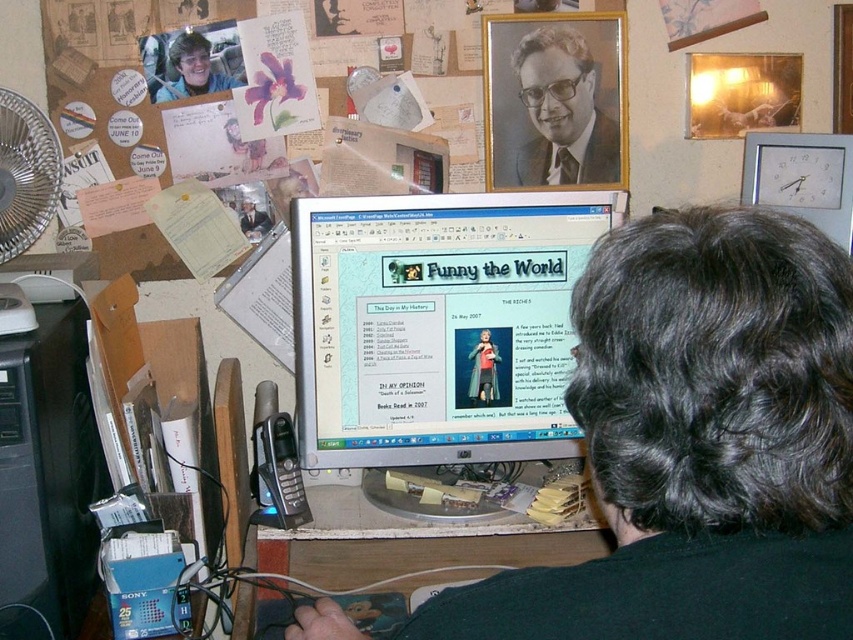
Between silver metallic computer monitor at center and formal black suit at upper center, which one appears on the right side from the viewer's perspective?

formal black suit at upper center is more to the right.

Can you confirm if silver metallic computer monitor at center is shorter than formal black suit at upper center?

Incorrect, silver metallic computer monitor at center's height does not fall short of formal black suit at upper center's.

Is point (387, 362) positioned before point (595, 173)?

Yes.

This screenshot has width=853, height=640. I want to click on silver metallic computer monitor at center, so click(x=437, y=323).

Between silver metallic computer monitor at center and matte black laptop at center, which one appears on the right side from the viewer's perspective?

silver metallic computer monitor at center

Is silver metallic computer monitor at center taller than matte black laptop at center?

Yes.

Does point (509, 193) come in front of point (270, 221)?

Yes, it is.

You are a GUI agent. You are given a task and a screenshot of the screen. Output one action in this format:
    pyautogui.click(x=<x>, y=<y>)
    Task: Click on the silver metallic computer monitor at center
    
    Given the screenshot: What is the action you would take?
    pyautogui.click(x=437, y=323)

Does wooden at center have a greater height compared to white plastic clock at upper right?

No.

Does wooden at center appear on the left side of white plastic clock at upper right?

Indeed, wooden at center is positioned on the left side of white plastic clock at upper right.

Is point (407, 538) less distant than point (817, 200)?

Yes, point (407, 538) is in front of point (817, 200).

The height and width of the screenshot is (640, 853). Identify the location of wooden at center. (418, 556).